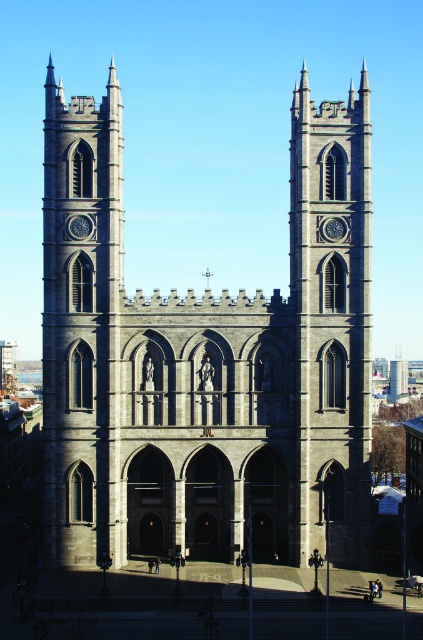
Is gray stone church at center to the right of gray stone clock tower at center from the viewer's perspective?

No, gray stone church at center is not to the right of gray stone clock tower at center.

Between gray stone church at center and gray stone clock tower at center, which one appears on the left side from the viewer's perspective?

From the viewer's perspective, gray stone church at center appears more on the left side.

Which is behind, point (175, 528) or point (307, 452)?

The point (175, 528) is behind.

Identify the location of gray stone church at center. (206, 362).